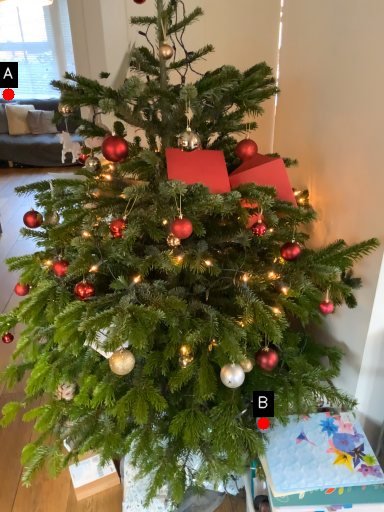
Question: Two points are circled on the image, labeled by A and B beside each circle. Which point is closer to the camera?

Choices:
 (A) A is closer
 (B) B is closer

Answer: (B)